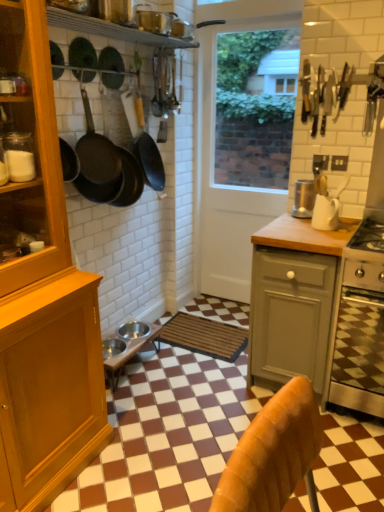
Question: Is black matte frying pan at upper center, the 3th frying pan from the front, taller than black matte frying pan at upper left, arranged as the 1th frying pan when viewed from the front?

Choices:
 (A) no
 (B) yes

Answer: (B)

Question: Is black matte frying pan at upper center, the 3th frying pan from the front, thinner than black matte frying pan at upper left, arranged as the 1th frying pan when viewed from the front?

Choices:
 (A) no
 (B) yes

Answer: (A)

Question: Is black matte frying pan at upper center, the 3th frying pan from the front, positioned beyond the bounds of black matte frying pan at upper left, arranged as the 1th frying pan when viewed from the front?

Choices:
 (A) no
 (B) yes

Answer: (B)

Question: From a real-world perspective, is black matte frying pan at upper center, which ranks as the first frying pan in back-to-front order, positioned under black matte frying pan at upper left, arranged as the 3th frying pan when viewed from the back, based on gravity?

Choices:
 (A) yes
 (B) no

Answer: (A)

Question: Is black matte frying pan at upper center, the 3th frying pan from the front, touching black matte frying pan at upper left, arranged as the 1th frying pan when viewed from the front?

Choices:
 (A) yes
 (B) no

Answer: (B)

Question: Can you confirm if black matte frying pan at upper center, which ranks as the first frying pan in back-to-front order, is bigger than black matte frying pan at upper left, arranged as the 1th frying pan when viewed from the front?

Choices:
 (A) no
 (B) yes

Answer: (B)

Question: Considering the relative positions of wooden cabinet at left and matte black frying pan at upper left, which ranks as the 2th frying pan in back-to-front order, in the image provided, is wooden cabinet at left behind matte black frying pan at upper left, which ranks as the 2th frying pan in back-to-front order,?

Choices:
 (A) no
 (B) yes

Answer: (A)

Question: Are wooden cabinet at left and matte black frying pan at upper left, the 2th frying pan when ordered from front to back, making contact?

Choices:
 (A) yes
 (B) no

Answer: (B)

Question: Is wooden cabinet at left closer to the viewer compared to matte black frying pan at upper left, which ranks as the 2th frying pan in back-to-front order?

Choices:
 (A) yes
 (B) no

Answer: (A)

Question: Would you say matte black frying pan at upper left, the 2th frying pan when ordered from front to back, is part of wooden cabinet at left's contents?

Choices:
 (A) yes
 (B) no

Answer: (B)

Question: Is wooden cabinet at left at the right side of matte black frying pan at upper left, which ranks as the 2th frying pan in back-to-front order?

Choices:
 (A) yes
 (B) no

Answer: (B)

Question: Considering the relative sizes of wooden cabinet at left and matte black frying pan at upper left, the 2th frying pan when ordered from front to back, in the image provided, is wooden cabinet at left taller than matte black frying pan at upper left, the 2th frying pan when ordered from front to back,?

Choices:
 (A) yes
 (B) no

Answer: (A)

Question: From the image's perspective, would you say white glossy door at center is shown under black matte frying pan at upper left, arranged as the 1th frying pan when viewed from the front?

Choices:
 (A) no
 (B) yes

Answer: (B)